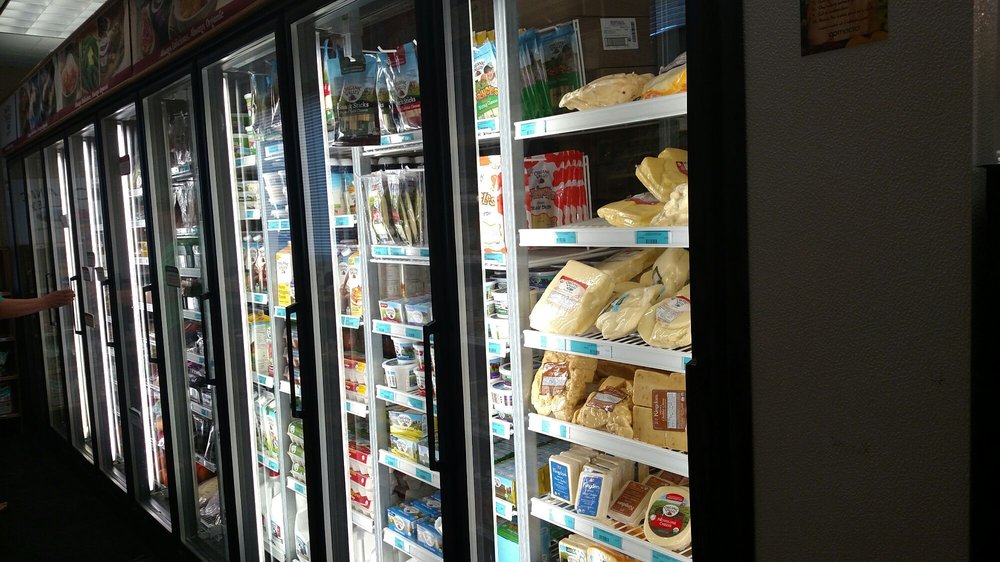
Identify the location of ceiling light box. (50, 7).